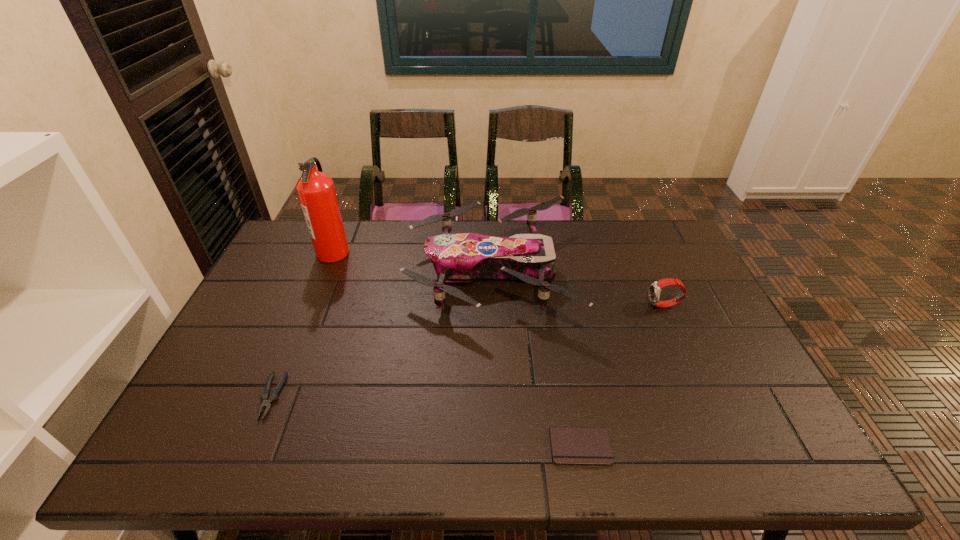
Image resolution: width=960 pixels, height=540 pixels. Identify the location of object present at the left edge. (316, 191).

You are a GUI agent. You are given a task and a screenshot of the screen. Output one action in this format:
    pyautogui.click(x=<x>, y=<y>)
    Task: Click on the object located at the right edge
    
    Given the screenshot: What is the action you would take?
    pyautogui.click(x=655, y=288)

The image size is (960, 540). Find the location of `object that is at the far left corner`. object that is at the far left corner is located at coordinates (316, 191).

The width and height of the screenshot is (960, 540). In the image, there is a desktop. In order to click on free space at the far edge in this screenshot , I will do `click(368, 246)`.

Locate an element on the screen. blank space at the near edge of the desktop is located at coordinates (420, 464).

In the image, there is a desktop. Identify the location of blank space at the left edge. (264, 288).

Locate an element on the screen. The height and width of the screenshot is (540, 960). vacant space at the right edge of the desktop is located at coordinates (732, 356).

At what (x,y) coordinates should I click in order to perform the action: click on free point at the far right corner. Please return your answer as a coordinate pair (x, y). The image size is (960, 540). Looking at the image, I should click on (653, 244).

This screenshot has height=540, width=960. I want to click on vacant space at the near right corner, so click(x=732, y=460).

Where is `free space between the tallest object and the drone`? This screenshot has height=540, width=960. free space between the tallest object and the drone is located at coordinates (412, 262).